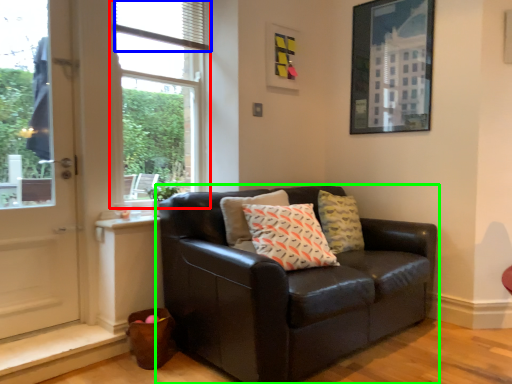
Question: Based on their relative distances, which object is farther from window (highlighted by a red box)? Choose from blind (highlighted by a blue box) and studio couch (highlighted by a green box).

Choices:
 (A) blind
 (B) studio couch

Answer: (B)